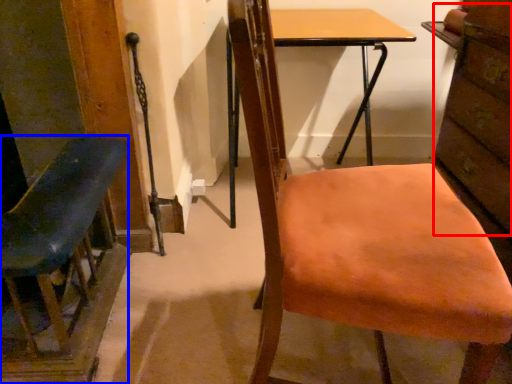
Question: Which point is closer to the camera, drawer (highlighted by a red box) or chair (highlighted by a blue box)?

Choices:
 (A) drawer
 (B) chair

Answer: (B)